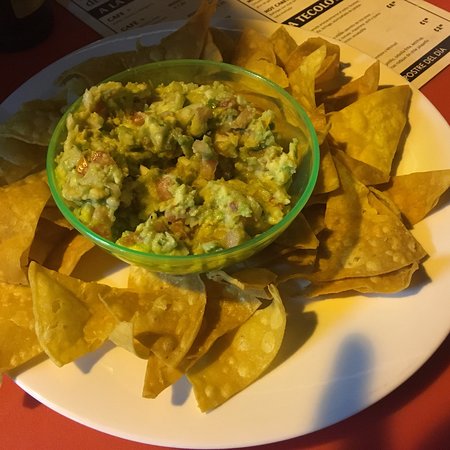
The width and height of the screenshot is (450, 450). Find the location of `red table`. red table is located at coordinates tap(26, 438).